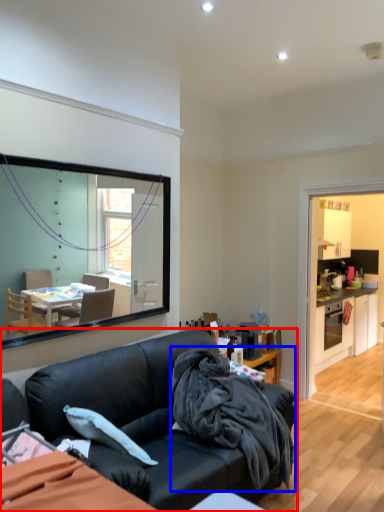
Question: Among these objects, which one is nearest to the camera, studio couch (highlighted by a red box) or blanket (highlighted by a blue box)?

Choices:
 (A) studio couch
 (B) blanket

Answer: (A)